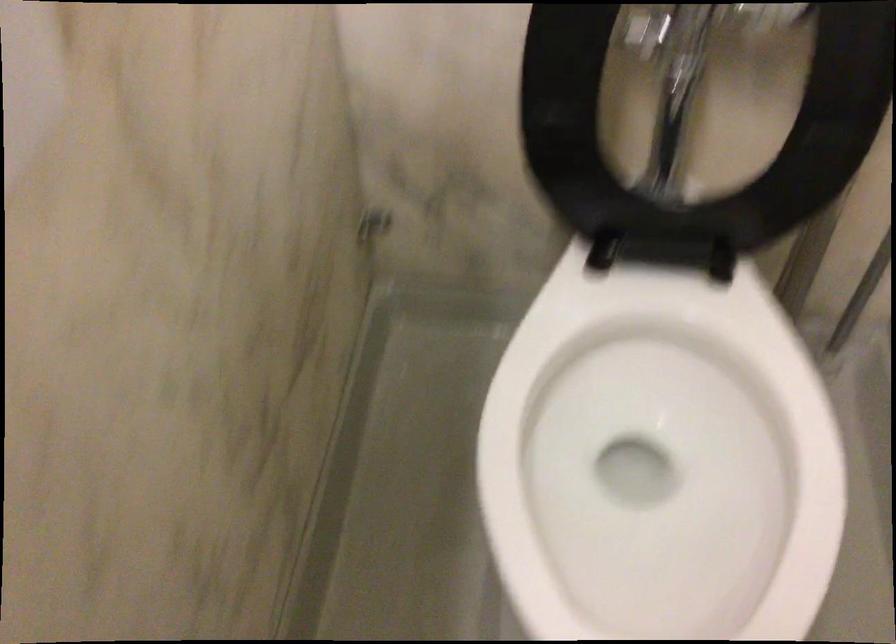
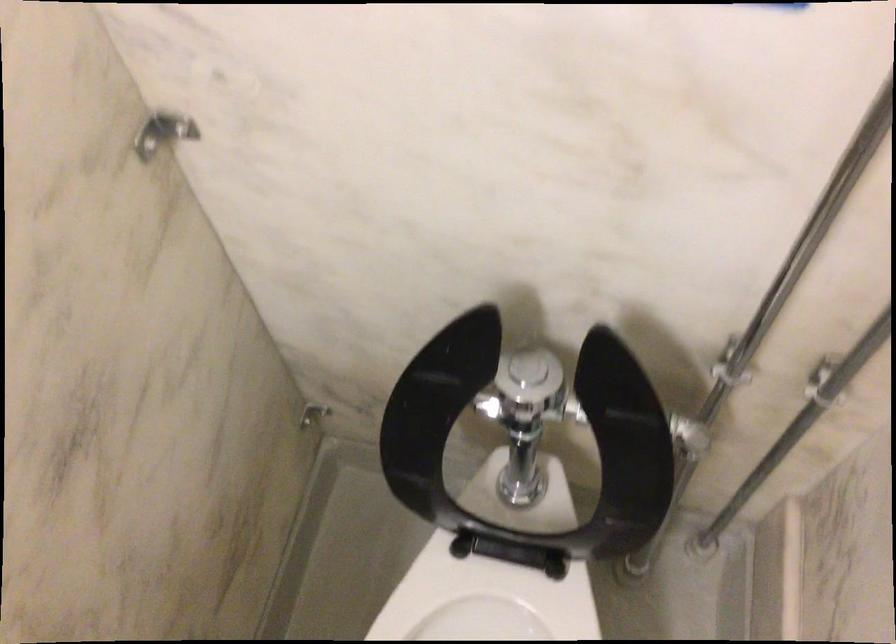
From the picture: Which direction would the cameraman need to move to produce the second image?

The cameraman moved toward right, backward.